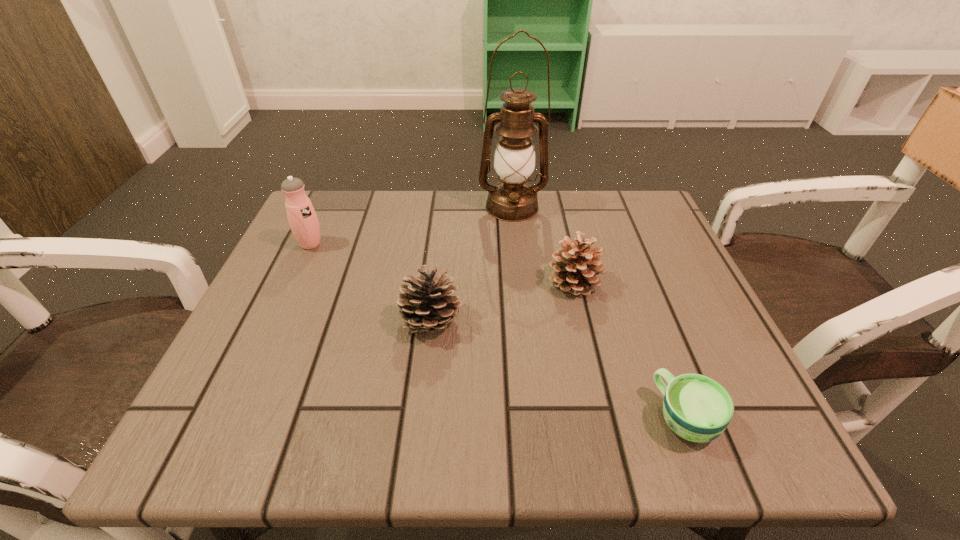
Find the location of `the farthest object`. the farthest object is located at coordinates coord(512,199).

I want to click on the tallest object, so click(x=512, y=199).

Locate an element on the screen. The height and width of the screenshot is (540, 960). the leftmost object is located at coordinates (302, 218).

The image size is (960, 540). I want to click on the fourth nearest object, so click(302, 218).

Locate an element on the screen. the second object from left to right is located at coordinates (428, 305).

Where is `the right pinecone`? the right pinecone is located at coordinates (575, 267).

Find the location of a particular element. The height and width of the screenshot is (540, 960). the nearest object is located at coordinates (697, 408).

Locate an element on the screen. the shortest object is located at coordinates (697, 408).

Identify the location of vacant region located 0.140m on the right of the oil lamp. (602, 207).

The height and width of the screenshot is (540, 960). In order to click on vacant position located 0.340m on the front of the leftmost object in this screenshot , I will do `click(245, 386)`.